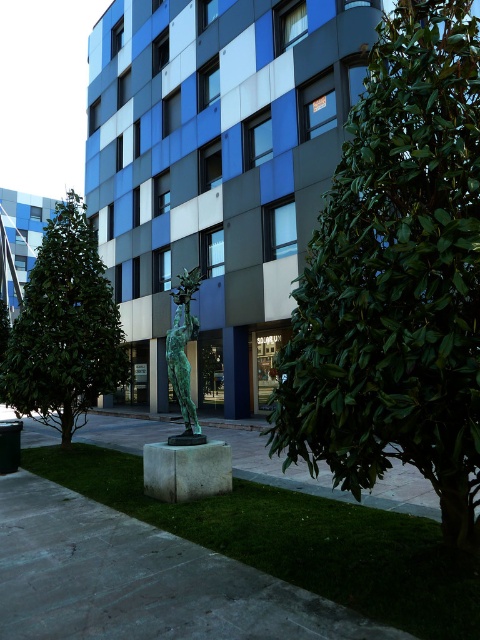
You are standing in front of the modern building and notice two green leafy trees. Which tree, the green leafy tree at right or the green leafy tree at left, is positioned higher up in the image?

The green leafy tree at right is located above the green leafy tree at left, so it is positioned higher up in the image.

In the scene shown: You are standing at the point marked as point (64, 328) in the image. What object is directly in front of you?

The point (64, 328) corresponds to the green leafy tree at left, so the object directly in front of you is the green leafy tree at left.